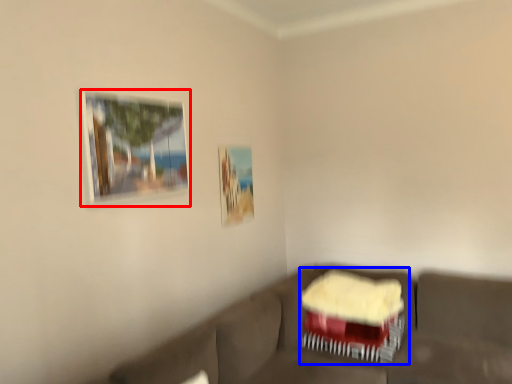
Question: Among these objects, which one is nearest to the camera, picture frame (highlighted by a red box) or swivel chair (highlighted by a blue box)?

Choices:
 (A) picture frame
 (B) swivel chair

Answer: (A)